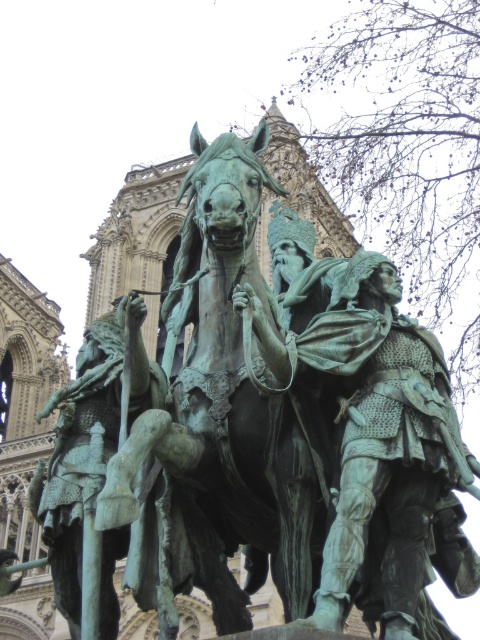
Question: Which object is positioned closest to the green patina armor at center?

Choices:
 (A) green patinated bronze horse at center
 (B) green patina statue at center

Answer: (A)

Question: Which of the following is the closest to the observer?

Choices:
 (A) green patina armor at center
 (B) green patinated bronze horse at center

Answer: (B)

Question: Is green patina armor at center above green patinated bronze horse at center?

Choices:
 (A) no
 (B) yes

Answer: (A)

Question: Estimate the real-world distances between objects in this image. Which object is closer to the green patina armor at center?

Choices:
 (A) green patinated bronze horse at center
 (B) green patina statue at center

Answer: (A)

Question: Does green patina armor at center have a larger size compared to green patinated bronze horse at center?

Choices:
 (A) no
 (B) yes

Answer: (A)

Question: Can you confirm if green patina armor at center is positioned to the right of green patinated bronze horse at center?

Choices:
 (A) no
 (B) yes

Answer: (B)